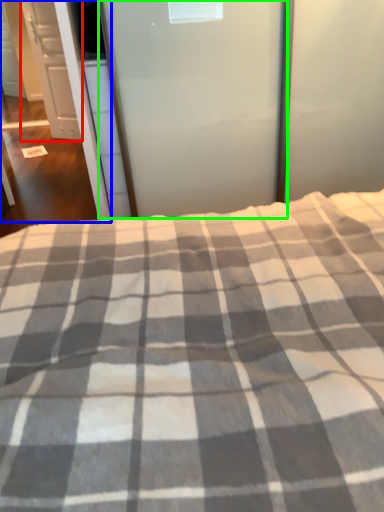
Question: Which is farther away from cabinetry (highlighted by a red box)? screen door (highlighted by a blue box) or screen door (highlighted by a green box)?

Choices:
 (A) screen door
 (B) screen door

Answer: (B)